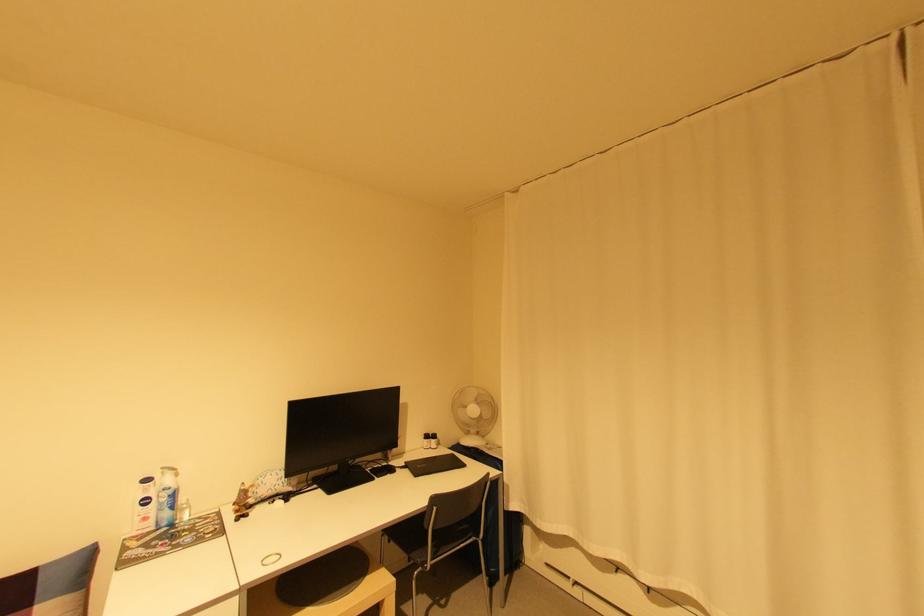
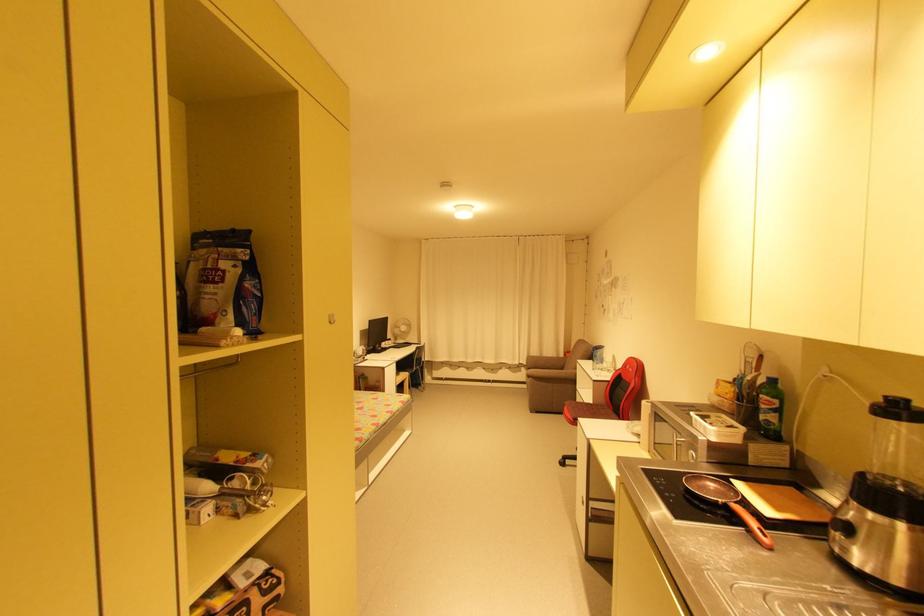
Find the pixel in the second image that matches point (438, 440) in the first image.

(395, 342)